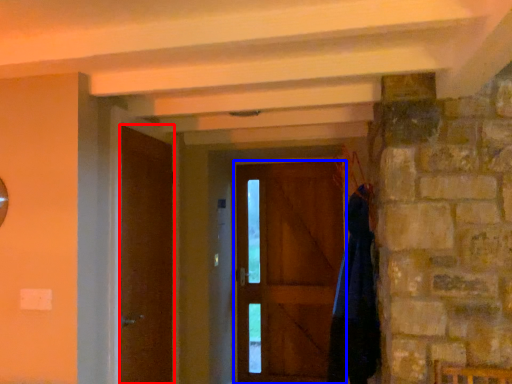
Question: Which point is closer to the camera, door (highlighted by a red box) or door (highlighted by a blue box)?

Choices:
 (A) door
 (B) door

Answer: (A)